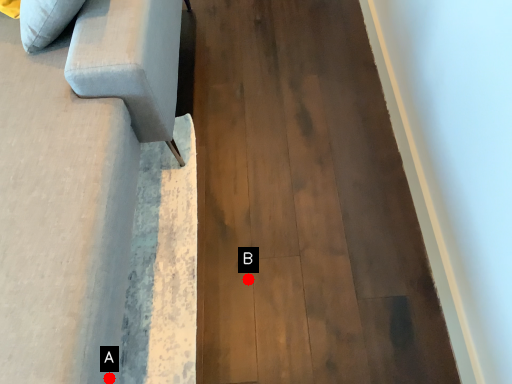
Question: Two points are circled on the image, labeled by A and B beside each circle. Among these points, which one is farthest from the camera?

Choices:
 (A) A is further
 (B) B is further

Answer: (B)